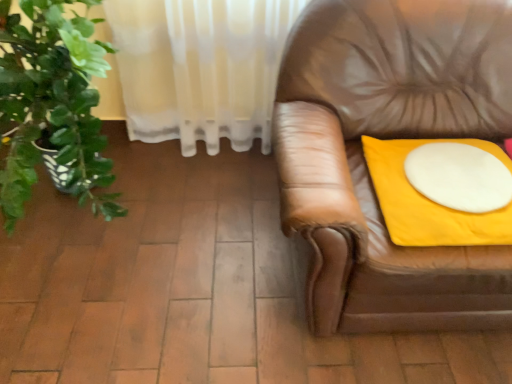
Question: Considering the positions of yellow fabric cushion at right and white matte round table at right in the image, is yellow fabric cushion at right wider or thinner than white matte round table at right?

Choices:
 (A) wide
 (B) thin

Answer: (A)

Question: From the image's perspective, is yellow fabric cushion at right located above or below white matte round table at right?

Choices:
 (A) below
 (B) above

Answer: (A)

Question: Choose the correct answer: Is yellow fabric cushion at right inside white matte round table at right or outside it?

Choices:
 (A) inside
 (B) outside

Answer: (B)

Question: Is white matte round table at right taller or shorter than yellow fabric cushion at right?

Choices:
 (A) tall
 (B) short

Answer: (B)

Question: Is white matte round table at right wider or thinner than yellow fabric cushion at right?

Choices:
 (A) wide
 (B) thin

Answer: (B)

Question: From the image's perspective, is white matte round table at right located above or below yellow fabric cushion at right?

Choices:
 (A) above
 (B) below

Answer: (A)

Question: In terms of size, does white matte round table at right appear bigger or smaller than yellow fabric cushion at right?

Choices:
 (A) big
 (B) small

Answer: (B)